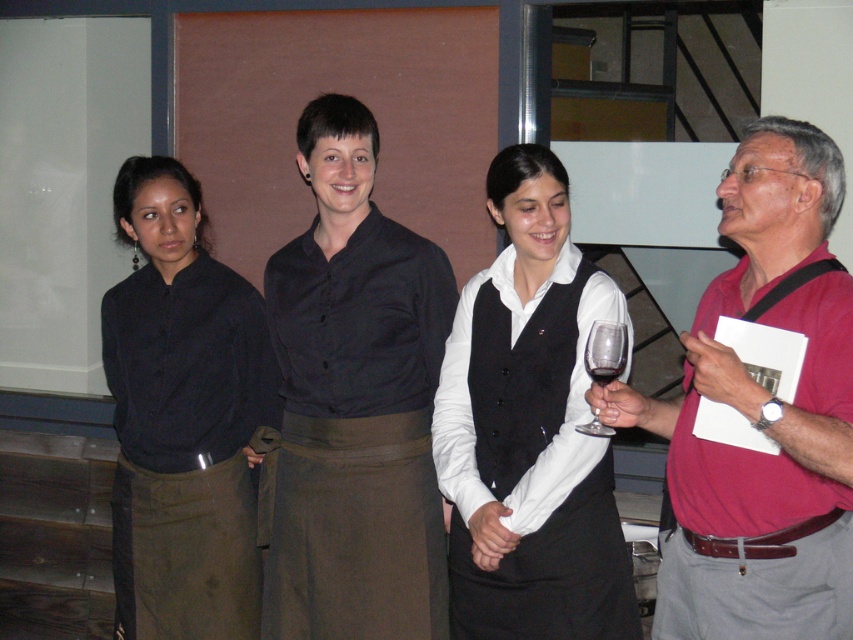
Question: Does white matte vest at center have a lesser width compared to transparent glass at right?

Choices:
 (A) yes
 (B) no

Answer: (B)

Question: Which object is closer to the camera taking this photo?

Choices:
 (A) white matte vest at center
 (B) black satin shirt at center
 (C) red glass at center

Answer: (C)

Question: Observing the image, what is the correct spatial positioning of black satin shirt at center in reference to red glass at center?

Choices:
 (A) above
 (B) below

Answer: (B)

Question: Estimate the real-world distances between objects in this image. Which object is farther from the white matte vest at center?

Choices:
 (A) transparent glass at right
 (B) black matte shirt at left
 (C) black satin shirt at center
 (D) red glass at center

Answer: (B)

Question: Which object appears closest to the camera in this image?

Choices:
 (A) red glass at center
 (B) black matte shirt at left
 (C) pink matte shirt at right

Answer: (C)

Question: Is black matte shirt at left thinner than transparent glass at right?

Choices:
 (A) yes
 (B) no

Answer: (B)